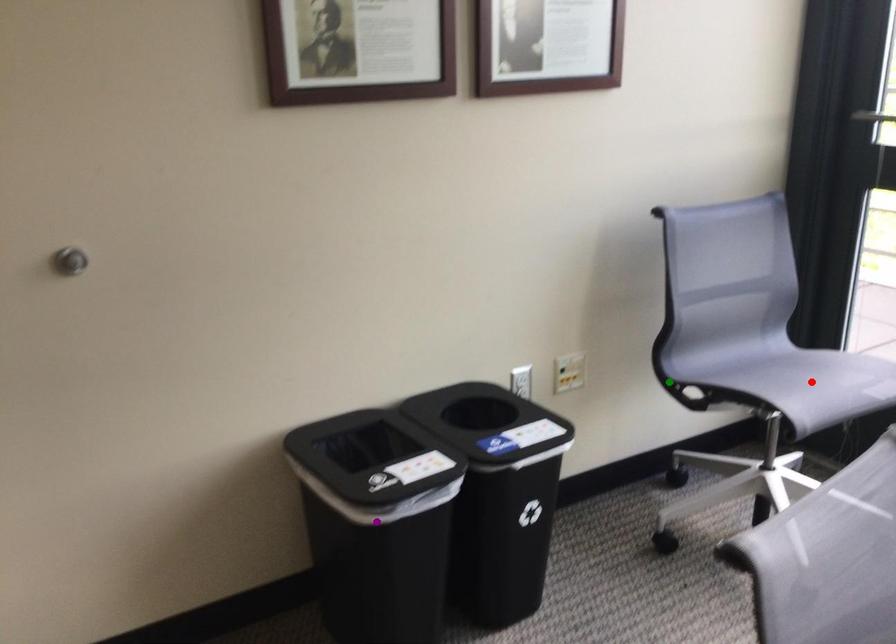
In the scene shown: Order these from nearest to farthest:
1. red point
2. purple point
3. green point

1. green point
2. red point
3. purple point